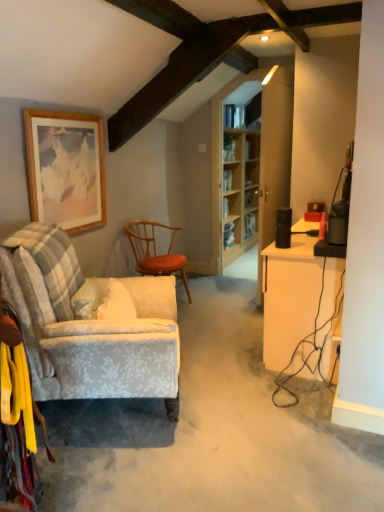
Question: Should I look upward or downward to see wooden picture frame at upper left?

Choices:
 (A) down
 (B) up

Answer: (B)

Question: Is white glossy desk at right bigger than wooden textured chair at center, the 1th chair when ordered from back to front?

Choices:
 (A) yes
 (B) no

Answer: (A)

Question: Is white glossy desk at right not within wooden textured chair at center, the 1th chair when ordered from back to front?

Choices:
 (A) no
 (B) yes

Answer: (B)

Question: Is white glossy desk at right oriented away from wooden textured chair at center, the 1th chair when ordered from back to front?

Choices:
 (A) yes
 (B) no

Answer: (B)

Question: From the image's perspective, does white glossy desk at right appear higher than wooden textured chair at center, the 1th chair when ordered from back to front?

Choices:
 (A) yes
 (B) no

Answer: (B)

Question: Would you consider white glossy desk at right to be distant from wooden textured chair at center, the 1th chair when ordered from back to front?

Choices:
 (A) no
 (B) yes

Answer: (B)

Question: From a real-world perspective, is white glossy desk at right located higher than wooden textured chair at center, the 1th chair when ordered from back to front?

Choices:
 (A) no
 (B) yes

Answer: (A)

Question: Is wooden textured chair at center, the 1th chair when ordered from back to front, to the left of light blue fabric armchair at left, which is the second chair in back-to-front order, from the viewer's perspective?

Choices:
 (A) no
 (B) yes

Answer: (A)

Question: Can you confirm if wooden textured chair at center, the 1th chair when ordered from back to front, is bigger than light blue fabric armchair at left, which is the second chair in back-to-front order?

Choices:
 (A) no
 (B) yes

Answer: (A)

Question: Considering the relative positions of wooden textured chair at center, which appears as the second chair when viewed from the front, and light blue fabric armchair at left, which is the second chair in back-to-front order, in the image provided, is wooden textured chair at center, which appears as the second chair when viewed from the front, to the right of light blue fabric armchair at left, which is the second chair in back-to-front order, from the viewer's perspective?

Choices:
 (A) no
 (B) yes

Answer: (B)

Question: Is there a large distance between wooden textured chair at center, which appears as the second chair when viewed from the front, and light blue fabric armchair at left, which is the second chair in back-to-front order?

Choices:
 (A) yes
 (B) no

Answer: (A)

Question: Can you confirm if wooden textured chair at center, which appears as the second chair when viewed from the front, is wider than light blue fabric armchair at left, which is the second chair in back-to-front order?

Choices:
 (A) yes
 (B) no

Answer: (B)

Question: Can you confirm if wooden textured chair at center, the 1th chair when ordered from back to front, is shorter than light blue fabric armchair at left, which is the second chair in back-to-front order?

Choices:
 (A) yes
 (B) no

Answer: (A)

Question: Is light blue fabric armchair at left, which ranks as the 1th chair in front-to-back order, behind wooden textured chair at center, the 1th chair when ordered from back to front?

Choices:
 (A) yes
 (B) no

Answer: (B)